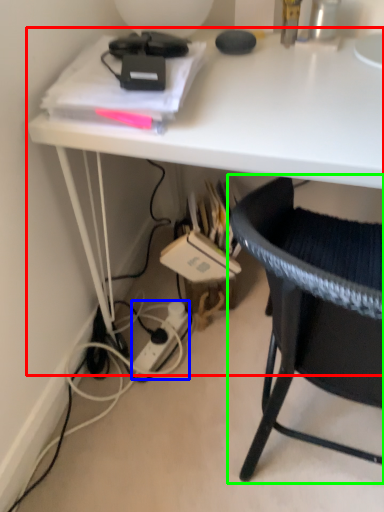
Question: Which object is the closest to the desk (highlighted by a red box)? Choose among these: power outlet (highlighted by a blue box) or chair (highlighted by a green box).

Choices:
 (A) power outlet
 (B) chair

Answer: (B)